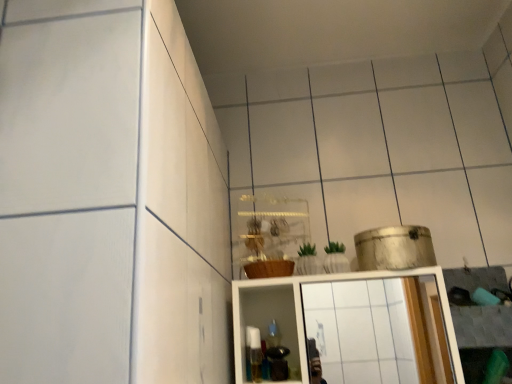
What is the approximate width of white glossy shelf at center?

It is 9.68 inches.

The width and height of the screenshot is (512, 384). Describe the element at coordinates (353, 326) in the screenshot. I see `white glossy shelf at center` at that location.

You are a GUI agent. You are given a task and a screenshot of the screen. Output one action in this format:
    pyautogui.click(x=<x>, y=<y>)
    Task: Click on the white glossy shelf at center
    
    Given the screenshot: What is the action you would take?
    pyautogui.click(x=353, y=326)

The image size is (512, 384). Find the location of `white glossy shelf at center`. white glossy shelf at center is located at coordinates (353, 326).